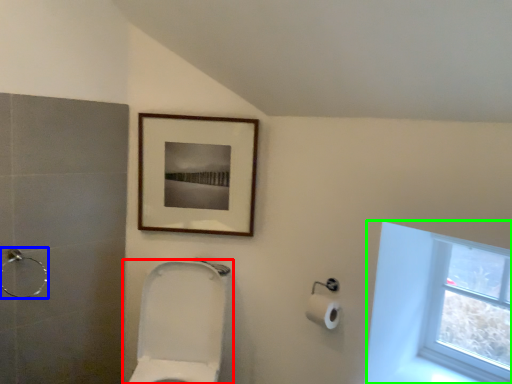
Question: Estimate the real-world distances between objects in this image. Which object is closer to toilet (highlighted by a red box), shower (highlighted by a blue box) or window (highlighted by a green box)?

Choices:
 (A) shower
 (B) window

Answer: (A)